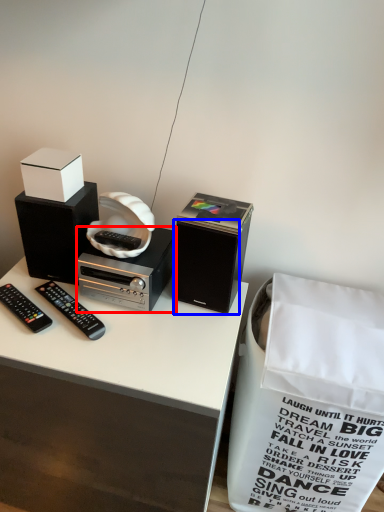
Question: Which point is closer to the camera, cassette (highlighted by a red box) or speaker (highlighted by a blue box)?

Choices:
 (A) cassette
 (B) speaker

Answer: (B)